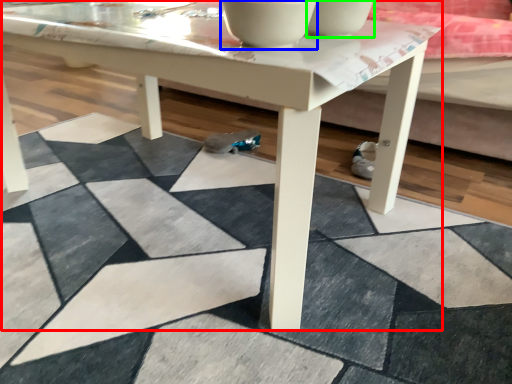
Question: Which object is the closest to the coffee table (highlighted by a red box)? Choose among these: bowl (highlighted by a blue box) or bowl (highlighted by a green box).

Choices:
 (A) bowl
 (B) bowl

Answer: (A)